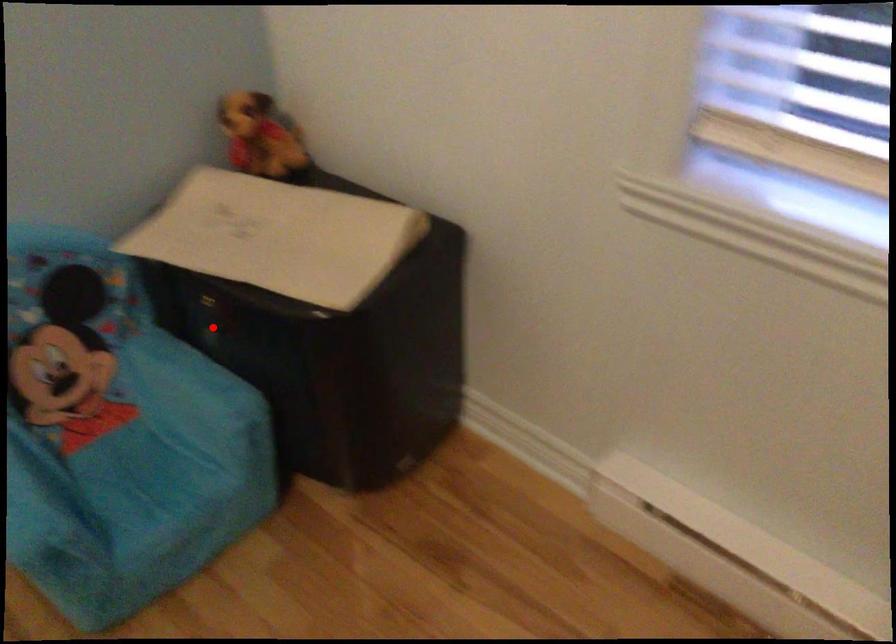
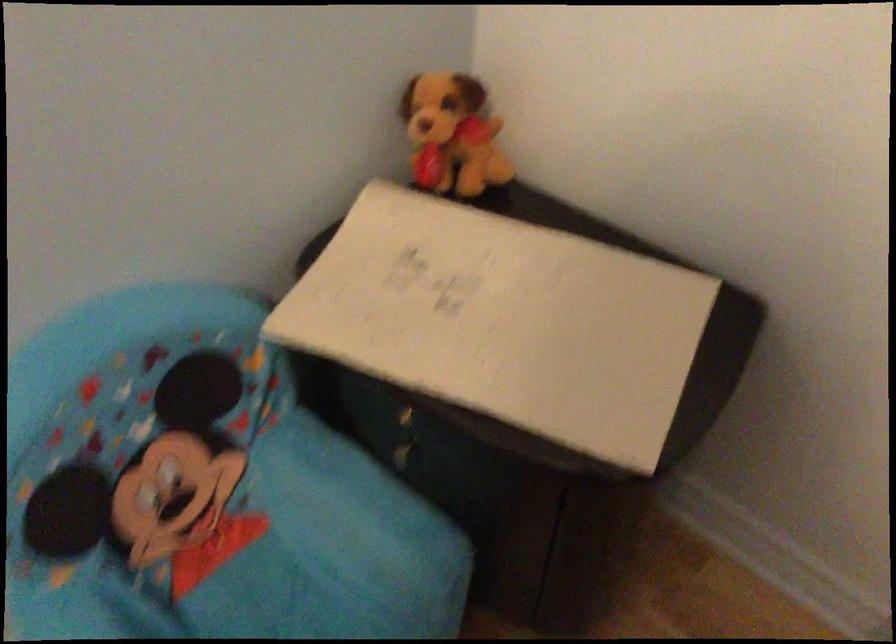
Question: I am providing you with two images of the same scene from different viewpoints. Given a red point in image1, look at the same physical point in image2. Is it:

Choices:
 (A) Closer to the viewpoint
 (B) Farther from the viewpoint

Answer: (A)